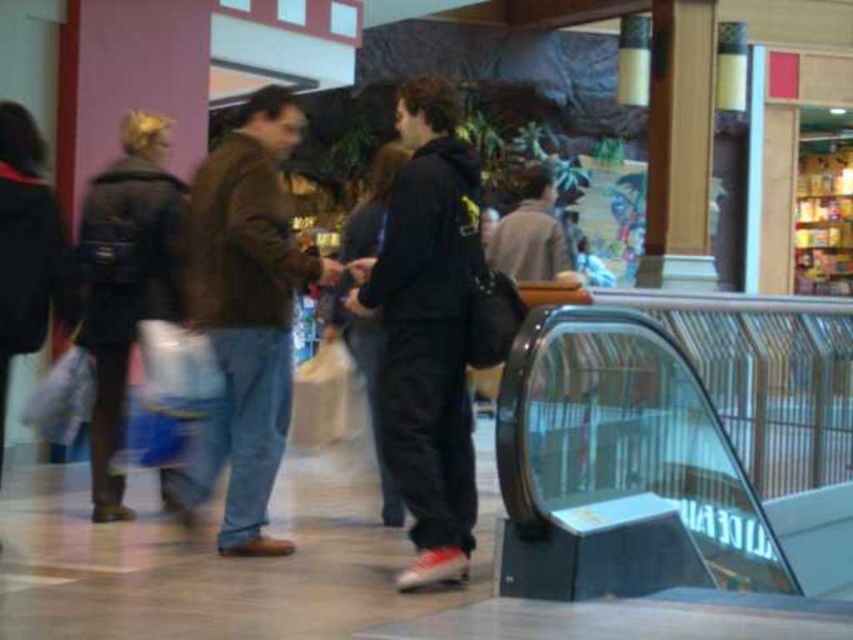
Question: Which object appears farthest from the camera in this image?

Choices:
 (A) brown leather jacket at left
 (B) dark gray hoodie at center

Answer: (A)

Question: Where is dark gray hoodie at center located in relation to brown leather jacket at left in the image?

Choices:
 (A) left
 (B) right

Answer: (B)

Question: Is dark gray hoodie at center positioned at the back of brown leather jacket at left?

Choices:
 (A) no
 (B) yes

Answer: (A)

Question: Is dark gray hoodie at center further to camera compared to brown leather jacket at left?

Choices:
 (A) yes
 (B) no

Answer: (B)